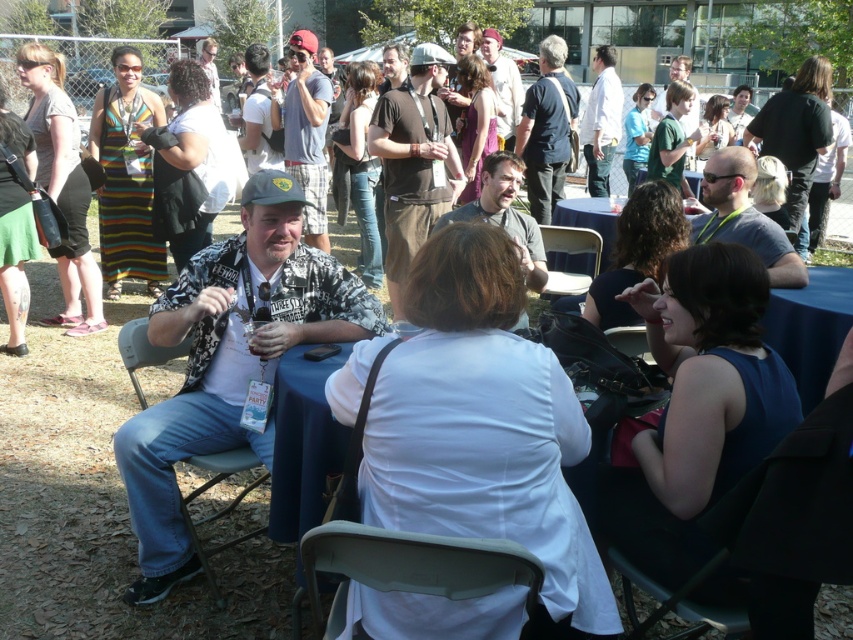
Question: Is green plastic chair at center positioned at the back of brown cotton t-shirt at center?

Choices:
 (A) no
 (B) yes

Answer: (A)

Question: Does denim shorts at center have a greater width compared to dark blue shirt at upper center?

Choices:
 (A) no
 (B) yes

Answer: (B)

Question: Which object appears closest to the camera in this image?

Choices:
 (A) brown cotton t-shirt at center
 (B) printed cotton shirt at center
 (C) light brown leather jacket at upper center
 (D) green fabric shirt at upper center

Answer: (B)

Question: Among these objects, which one is nearest to the camera?

Choices:
 (A) white shirt at upper center
 (B) blue fabric table at upper center
 (C) dark blue shirt at upper center

Answer: (B)

Question: Estimate the real-world distances between objects in this image. Which object is farther from the brown cotton t-shirt at center?

Choices:
 (A) dark brown leather jacket at center
 (B) denim fabric chair at lower left
 (C) green plastic chair at center

Answer: (C)

Question: Does brown cotton t-shirt at center have a lesser width compared to blue fabric table at lower right?

Choices:
 (A) yes
 (B) no

Answer: (A)